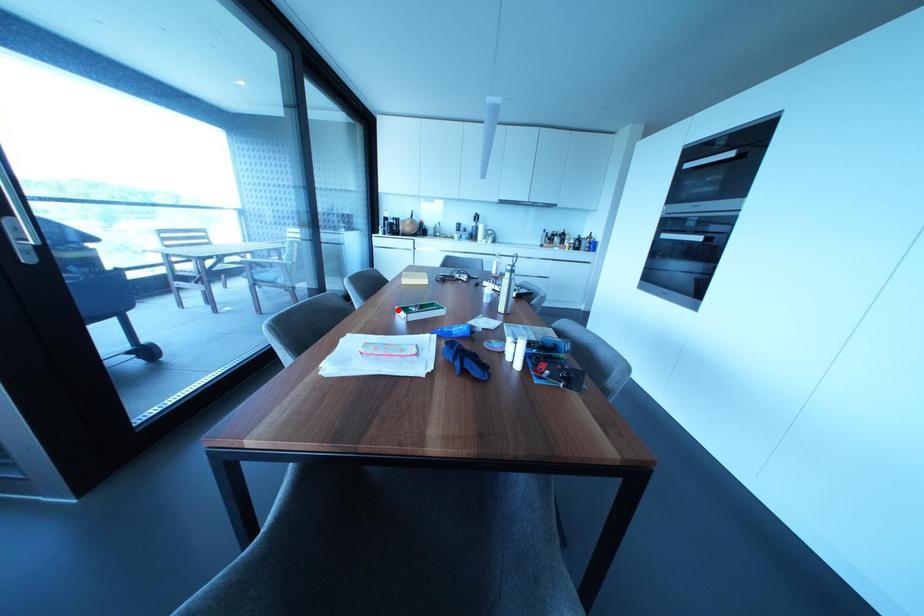
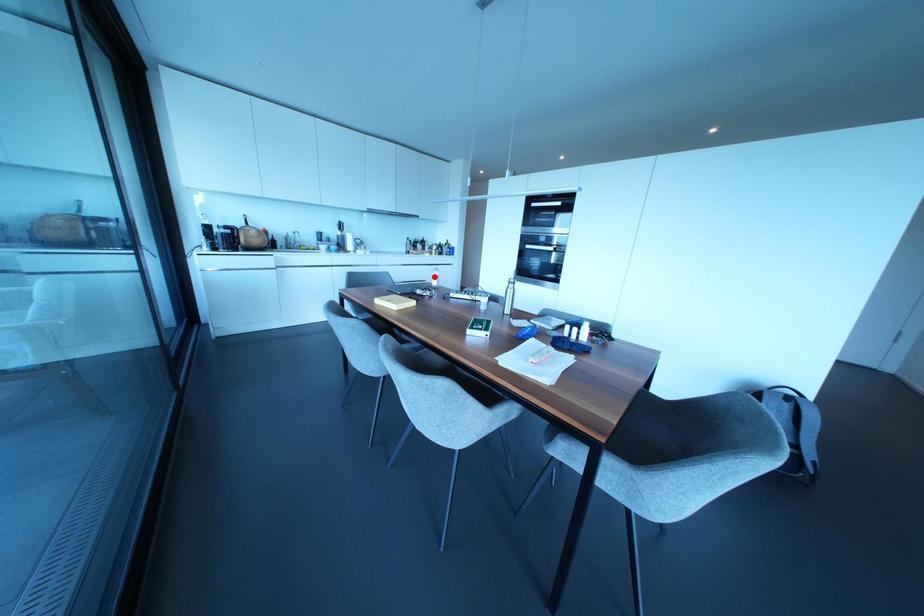
Based on the photo, I am providing you with two images of the same scene from different viewpoints. A red point is marked on the first image and another point is marked on the second image. Are the points marked in image1 and image2 representing the same 3D position?

No